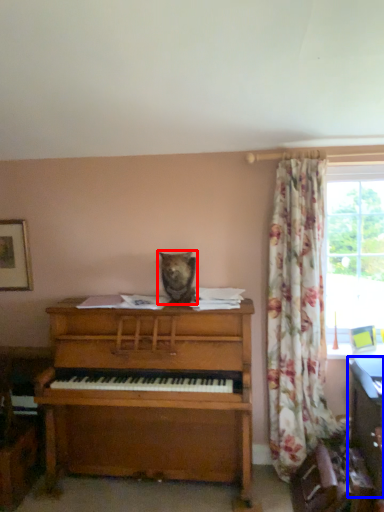
Question: Among these objects, which one is nearest to the camera, animal (highlighted by a red box) or computer desk (highlighted by a blue box)?

Choices:
 (A) animal
 (B) computer desk

Answer: (B)